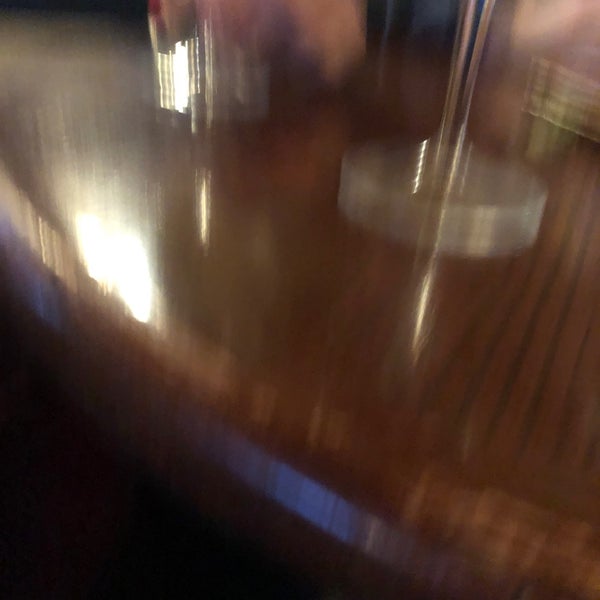
At what (x,y) coordinates should I click in order to perform the action: click on table. Please return your answer as a coordinate pair (x, y). This screenshot has height=600, width=600. Looking at the image, I should click on (260, 471).